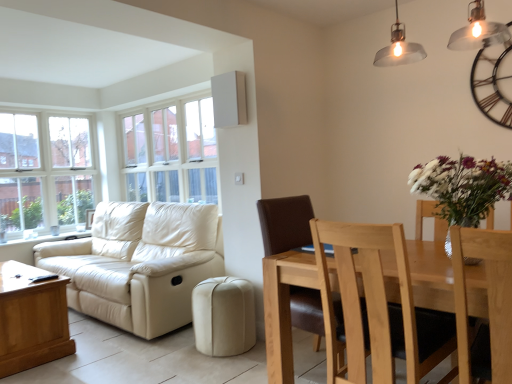
The image size is (512, 384). I want to click on free point to the right of light brown wooden coffee table at lower left, so click(102, 355).